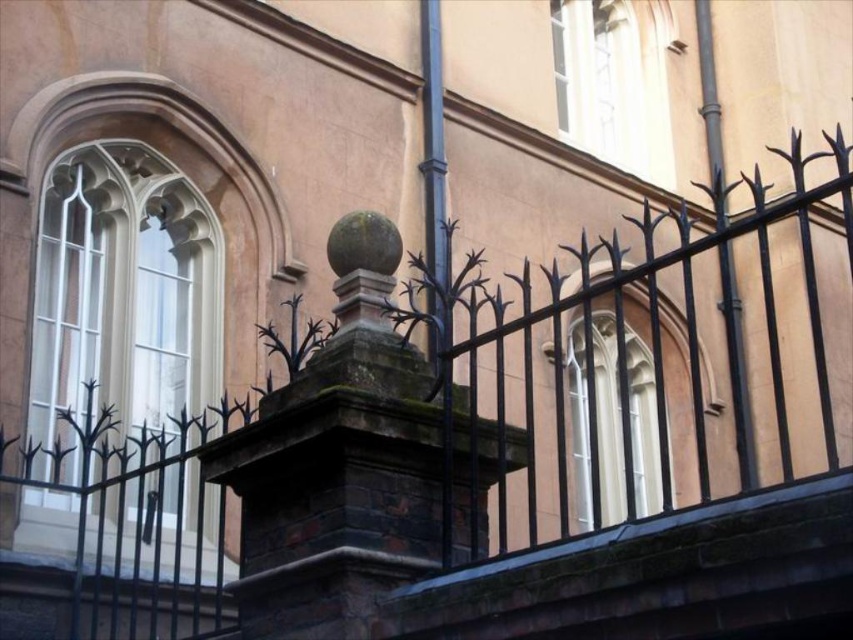
The width and height of the screenshot is (853, 640). Identify the location of clear glass window at upper center. (x=613, y=83).

What are the coordinates of `clear glass window at upper center` in the screenshot? It's located at (613, 83).

Who is lower down, clear glass window at center or smooth metal pole at right?

clear glass window at center is lower down.

In the scene shown: Can you confirm if clear glass window at center is wider than smooth metal pole at right?

In fact, clear glass window at center might be narrower than smooth metal pole at right.

Where is `clear glass window at center`? This screenshot has height=640, width=853. clear glass window at center is located at coordinates (613, 420).

Is clear glass window at upper center shorter than smooth metal pole at right?

Yes.

Which is above, clear glass window at upper center or smooth metal pole at right?

clear glass window at upper center is higher up.

This screenshot has height=640, width=853. In order to click on clear glass window at upper center in this screenshot , I will do `click(613, 83)`.